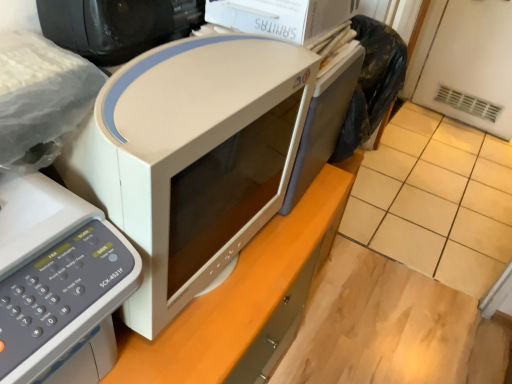
The height and width of the screenshot is (384, 512). What are the coordinates of `black glossy desktop computer at upper left` in the screenshot? It's located at (117, 25).

The width and height of the screenshot is (512, 384). I want to click on white matte microwave at left, the first home appliance positioned from the left, so click(x=58, y=282).

This screenshot has width=512, height=384. I want to click on white matte computer desk at center, so click(245, 300).

The image size is (512, 384). Describe the element at coordinates (436, 200) in the screenshot. I see `beige tile at center` at that location.

This screenshot has width=512, height=384. In order to click on black glossy desktop computer at upper left in this screenshot , I will do `click(117, 25)`.

Consider the image. Is white matte microwave at left, the second home appliance when ordered from right to left, oriented away from black glossy desktop computer at upper left?

No, black glossy desktop computer at upper left is not at the back of white matte microwave at left, the second home appliance when ordered from right to left.

From the image's perspective, does white matte microwave at left, the first home appliance positioned from the left, appear lower than black glossy desktop computer at upper left?

Yes, from the image's perspective, white matte microwave at left, the first home appliance positioned from the left, is below black glossy desktop computer at upper left.

Does point (64, 207) come closer to viewer compared to point (83, 10)?

Yes, point (64, 207) is in front of point (83, 10).

Which object is thinner, white matte microwave at left, the first home appliance positioned from the left, or black glossy desktop computer at upper left?

Thinner between the two is black glossy desktop computer at upper left.

The image size is (512, 384). In order to click on the 1st home appliance in front of the beige tile at center in this screenshot , I will do `click(192, 157)`.

Considering the sizes of objects beige tile at center and white matte microwave at center, which is counted as the second home appliance, starting from the left, in the image provided, who is taller, beige tile at center or white matte microwave at center, which is counted as the second home appliance, starting from the left,?

white matte microwave at center, which is counted as the second home appliance, starting from the left, is taller.

Is beige tile at center far from white matte microwave at center, the first home appliance from the right?

Yes, beige tile at center and white matte microwave at center, the first home appliance from the right, are located far from each other.

How different are the orientations of beige tile at center and white matte microwave at center, which is counted as the second home appliance, starting from the left, in degrees?

The angle between the facing direction of beige tile at center and the facing direction of white matte microwave at center, which is counted as the second home appliance, starting from the left, is 85.7 degrees.

Looking at this image, how different are the orientations of white matte microwave at center, which is counted as the second home appliance, starting from the left, and white matte computer desk at center in degrees?

white matte microwave at center, which is counted as the second home appliance, starting from the left, and white matte computer desk at center are facing 2.59 degrees away from each other.

Do you think white matte microwave at center, the first home appliance from the right, is within white matte computer desk at center, or outside of it?

white matte microwave at center, the first home appliance from the right, lies outside white matte computer desk at center.

Looking at this image, from the image's perspective, relative to white matte computer desk at center, is white matte microwave at center, which is counted as the second home appliance, starting from the left, above or below?

Clearly, from the image's perspective, white matte microwave at center, which is counted as the second home appliance, starting from the left, is above white matte computer desk at center.

Who is bigger, white matte microwave at center, the first home appliance from the right, or white matte computer desk at center?

white matte computer desk at center.

From the image's perspective, which one is positioned lower, black glossy desktop computer at upper left or white matte microwave at left, the second home appliance when ordered from right to left?

From the image's view, white matte microwave at left, the second home appliance when ordered from right to left, is below.

Does black glossy desktop computer at upper left turn towards white matte microwave at left, the second home appliance when ordered from right to left?

No.

Does black glossy desktop computer at upper left have a greater width compared to white matte microwave at left, the first home appliance positioned from the left?

No, black glossy desktop computer at upper left is not wider than white matte microwave at left, the first home appliance positioned from the left.

Where is `desktop computer above the white matte microwave at left, the first home appliance positioned from the left (from a real-world perspective)`? The image size is (512, 384). desktop computer above the white matte microwave at left, the first home appliance positioned from the left (from a real-world perspective) is located at coordinates (117, 25).

Does white matte microwave at left, the first home appliance positioned from the left, have a lesser width compared to beige tile at center?

Yes, white matte microwave at left, the first home appliance positioned from the left, is thinner than beige tile at center.

Is white matte microwave at left, the second home appliance when ordered from right to left, next to beige tile at center and touching it?

No, white matte microwave at left, the second home appliance when ordered from right to left, is not in contact with beige tile at center.

From a real-world perspective, is white matte microwave at left, the second home appliance when ordered from right to left, below beige tile at center?

Incorrect, from a real-world perspective, white matte microwave at left, the second home appliance when ordered from right to left, is higher than beige tile at center.

Is white matte microwave at left, the second home appliance when ordered from right to left, further to camera compared to beige tile at center?

No, the depth of white matte microwave at left, the second home appliance when ordered from right to left, is less than that of beige tile at center.

Would you say white matte microwave at left, the second home appliance when ordered from right to left, is a long distance from white matte microwave at center, which is counted as the second home appliance, starting from the left?

No, white matte microwave at left, the second home appliance when ordered from right to left, is not far from white matte microwave at center, which is counted as the second home appliance, starting from the left.

From a real-world perspective, which object rests below the other?

From a 3D spatial view, white matte microwave at left, the first home appliance positioned from the left, is below.

Is the depth of white matte microwave at left, the first home appliance positioned from the left, greater than that of white matte microwave at center, which is counted as the second home appliance, starting from the left?

No, white matte microwave at left, the first home appliance positioned from the left, is closer to the camera.

Is white matte computer desk at center oriented away from black glossy desktop computer at upper left?

No, white matte computer desk at center is not facing the opposite direction of black glossy desktop computer at upper left.

Identify the location of computer desk that appears on the right of black glossy desktop computer at upper left. Image resolution: width=512 pixels, height=384 pixels. (245, 300).

Does white matte computer desk at center touch black glossy desktop computer at upper left?

No, white matte computer desk at center is not beside black glossy desktop computer at upper left.

I want to click on the 2nd home appliance below the black glossy desktop computer at upper left (from the image's perspective), so click(x=58, y=282).

The width and height of the screenshot is (512, 384). I want to click on tile that is under the white matte microwave at center, which is counted as the second home appliance, starting from the left (from a real-world perspective), so click(x=436, y=200).

Considering their positions, is white matte microwave at center, which is counted as the second home appliance, starting from the left, positioned further to white matte computer desk at center than black glossy desktop computer at upper left?

black glossy desktop computer at upper left.

Based on their spatial positions, is white matte microwave at left, the second home appliance when ordered from right to left, or white matte computer desk at center further from white matte microwave at center, which is counted as the second home appliance, starting from the left?

white matte computer desk at center is positioned further to the anchor white matte microwave at center, which is counted as the second home appliance, starting from the left.

Looking at the image, which one is located further to black glossy desktop computer at upper left, white matte microwave at center, which is counted as the second home appliance, starting from the left, or white matte microwave at left, the first home appliance positioned from the left?

white matte microwave at left, the first home appliance positioned from the left.

Estimate the real-world distances between objects in this image. Which object is further from black glossy desktop computer at upper left, beige tile at center or white matte computer desk at center?

The object further to black glossy desktop computer at upper left is beige tile at center.

Based on the photo, considering their positions, is white matte microwave at left, the second home appliance when ordered from right to left, positioned further to white matte computer desk at center than black glossy desktop computer at upper left?

black glossy desktop computer at upper left.

Considering their positions, is white matte microwave at left, the second home appliance when ordered from right to left, positioned further to beige tile at center than black glossy desktop computer at upper left?

Among the two, white matte microwave at left, the second home appliance when ordered from right to left, is located further to beige tile at center.

Considering their positions, is white matte computer desk at center positioned further to white matte microwave at center, the first home appliance from the right, than white matte microwave at left, the first home appliance positioned from the left?

Among the two, white matte computer desk at center is located further to white matte microwave at center, the first home appliance from the right.

Which object lies nearer to the anchor point beige tile at center, white matte microwave at left, the first home appliance positioned from the left, or white matte microwave at center, which is counted as the second home appliance, starting from the left?

white matte microwave at center, which is counted as the second home appliance, starting from the left, is closer to beige tile at center.

Identify the location of computer desk between white matte microwave at center, the first home appliance from the right, and beige tile at center in the front-back direction. The height and width of the screenshot is (384, 512). (245, 300).

What are the coordinates of `computer desk situated between black glossy desktop computer at upper left and beige tile at center from left to right` in the screenshot? It's located at (245, 300).

The image size is (512, 384). I want to click on home appliance between white matte microwave at center, which is counted as the second home appliance, starting from the left, and white matte computer desk at center in the up-down direction, so click(x=58, y=282).

At what (x,y) coordinates should I click in order to perform the action: click on desktop computer positioned between white matte microwave at center, which is counted as the second home appliance, starting from the left, and beige tile at center from near to far. Please return your answer as a coordinate pair (x, y). Looking at the image, I should click on (117, 25).